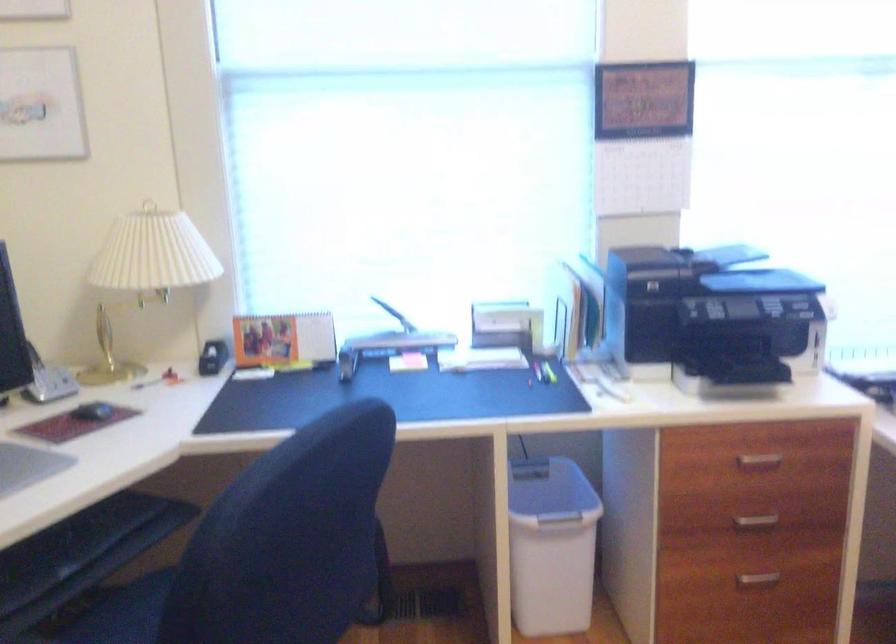
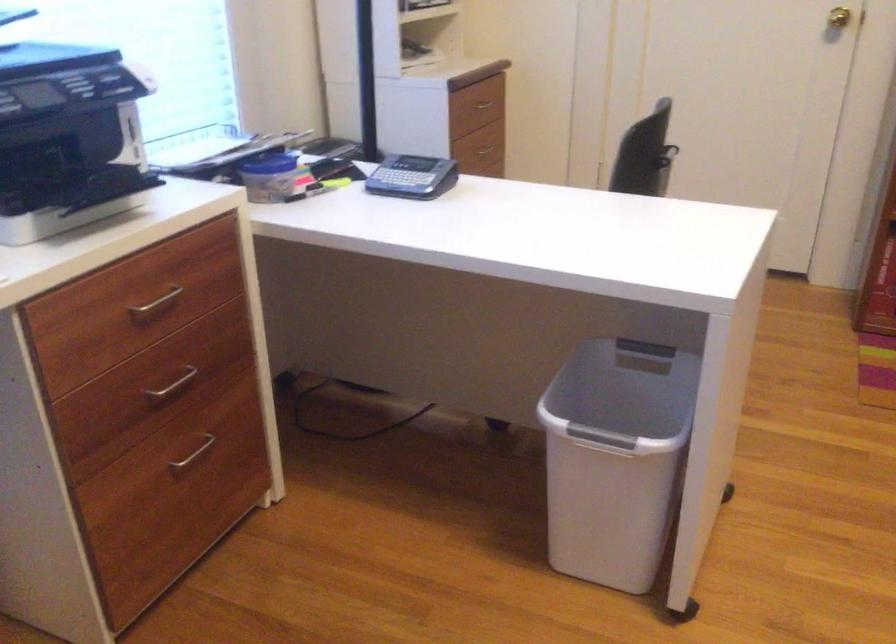
Based on the photo, the first image is from the beginning of the video and the second image is from the end. How did the camera likely rotate when shooting the video?

The camera rotated toward right-down.